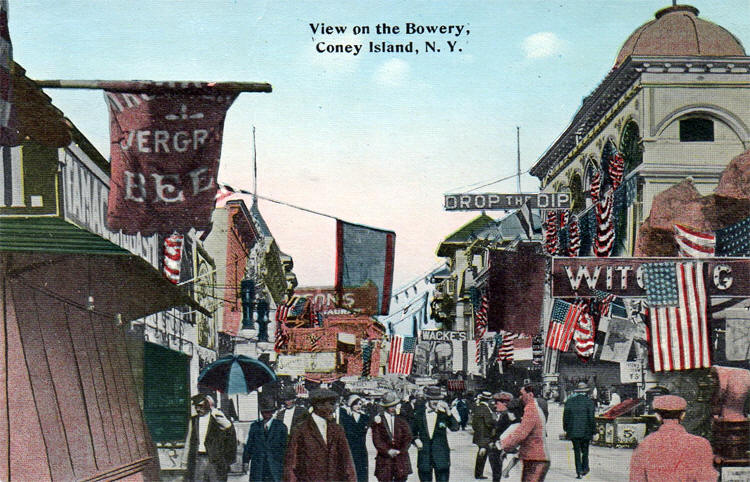
At what (x,y) coordinates should I click in order to perform the action: click on rooms. Please return your answer as a coordinate pair (x, y). The height and width of the screenshot is (482, 750). Looking at the image, I should click on (692, 38), (466, 232), (510, 230).